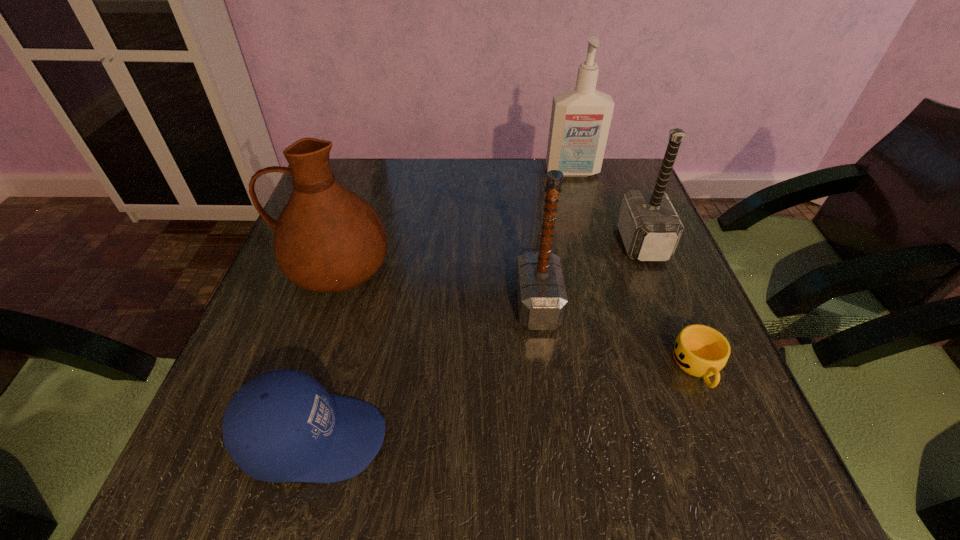
This screenshot has width=960, height=540. I want to click on blank space at the near right corner of the desktop, so click(670, 478).

You are a GUI agent. You are given a task and a screenshot of the screen. Output one action in this format:
    pyautogui.click(x=<x>, y=<y>)
    Task: Click on the free space between the shortest object and the left hammer
    
    Given the screenshot: What is the action you would take?
    pyautogui.click(x=617, y=335)

Find the location of `vacant area that lies between the second shortest object and the shortest object`. vacant area that lies between the second shortest object and the shortest object is located at coordinates (506, 402).

Locate an element on the screen. free space between the fifth tallest object and the pitcher is located at coordinates (325, 354).

Where is `vacant area that lies between the farthest object and the pitcher`? Image resolution: width=960 pixels, height=540 pixels. vacant area that lies between the farthest object and the pitcher is located at coordinates (454, 221).

Find the location of a particular element. empty location between the pitcher and the right hammer is located at coordinates (490, 256).

Locate an element on the screen. free space between the right hammer and the cup is located at coordinates (670, 305).

Locate an element on the screen. The width and height of the screenshot is (960, 540). vacant area between the right hammer and the fourth object from right to left is located at coordinates (589, 274).

This screenshot has width=960, height=540. Find the location of `free spot between the cup and the second shortest object`. free spot between the cup and the second shortest object is located at coordinates (506, 402).

At what (x,y) coordinates should I click in order to perform the action: click on unoccupied position between the pitcher and the nearer hammer. Please return your answer as a coordinate pair (x, y). Looking at the image, I should click on (437, 287).